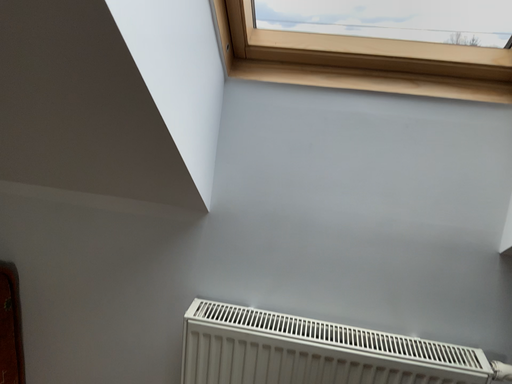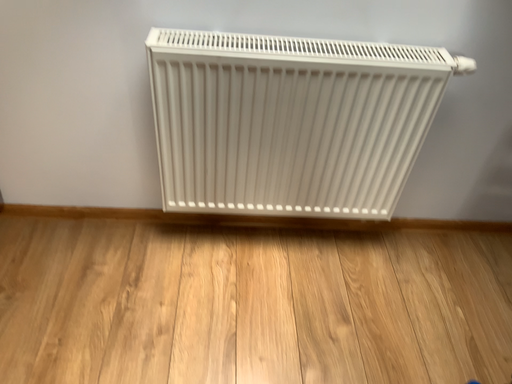
Question: Which way did the camera rotate in the video?

Choices:
 (A) rotated downward
 (B) rotated upward

Answer: (A)